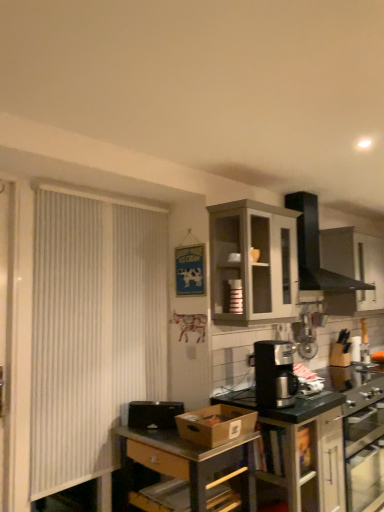
Question: Is black plastic coffee maker at center positioned with its back to black matte vent at upper center?

Choices:
 (A) yes
 (B) no

Answer: (B)

Question: Is black plastic coffee maker at center shorter than black matte vent at upper center?

Choices:
 (A) yes
 (B) no

Answer: (A)

Question: Can you confirm if black plastic coffee maker at center is wider than black matte vent at upper center?

Choices:
 (A) no
 (B) yes

Answer: (A)

Question: From the image's perspective, would you say black plastic coffee maker at center is positioned over black matte vent at upper center?

Choices:
 (A) no
 (B) yes

Answer: (A)

Question: Considering the relative sizes of black plastic coffee maker at center and black matte vent at upper center in the image provided, is black plastic coffee maker at center taller than black matte vent at upper center?

Choices:
 (A) no
 (B) yes

Answer: (A)

Question: Is white fabric curtain at left in front of or behind black plastic coffee maker at center in the image?

Choices:
 (A) front
 (B) behind

Answer: (A)

Question: From a real-world perspective, is white fabric curtain at left above or below black plastic coffee maker at center?

Choices:
 (A) above
 (B) below

Answer: (A)

Question: Considering the positions of point (112, 265) and point (264, 359), is point (112, 265) closer or farther from the camera than point (264, 359)?

Choices:
 (A) farther
 (B) closer

Answer: (A)

Question: Based on their sizes in the image, would you say white fabric curtain at left is bigger or smaller than black plastic coffee maker at center?

Choices:
 (A) small
 (B) big

Answer: (B)

Question: Relative to matte black coffee maker at center, which is the second cabinetry in top-to-bottom order, is black matte vent at upper center in front or behind?

Choices:
 (A) front
 (B) behind

Answer: (B)

Question: Is black matte vent at upper center wider or thinner than matte black coffee maker at center, positioned as the first cabinetry in bottom-to-top order?

Choices:
 (A) wide
 (B) thin

Answer: (B)

Question: Would you say black matte vent at upper center is to the left or to the right of matte black coffee maker at center, which is the second cabinetry in top-to-bottom order, in the picture?

Choices:
 (A) right
 (B) left

Answer: (A)

Question: In terms of height, does black matte vent at upper center look taller or shorter compared to matte black coffee maker at center, positioned as the first cabinetry in bottom-to-top order?

Choices:
 (A) short
 (B) tall

Answer: (A)

Question: Is matte black coffee maker at center, which is the second cabinetry in top-to-bottom order, wider or thinner than metallic gray table at center?

Choices:
 (A) wide
 (B) thin

Answer: (B)

Question: Considering the positions of matte black coffee maker at center, which is the second cabinetry in top-to-bottom order, and metallic gray table at center in the image, is matte black coffee maker at center, which is the second cabinetry in top-to-bottom order, taller or shorter than metallic gray table at center?

Choices:
 (A) short
 (B) tall

Answer: (B)